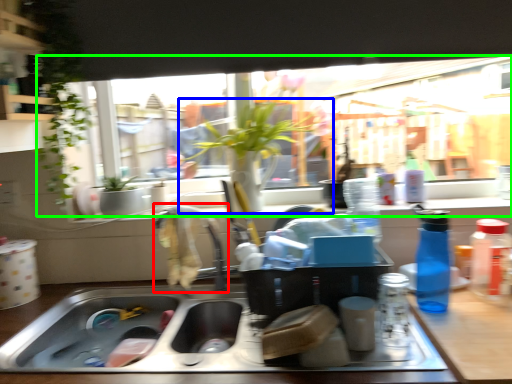
Question: Based on their relative distances, which object is farther from faucet (highlighted by a red box)? Choose from houseplant (highlighted by a blue box) and window (highlighted by a green box).

Choices:
 (A) houseplant
 (B) window

Answer: (B)